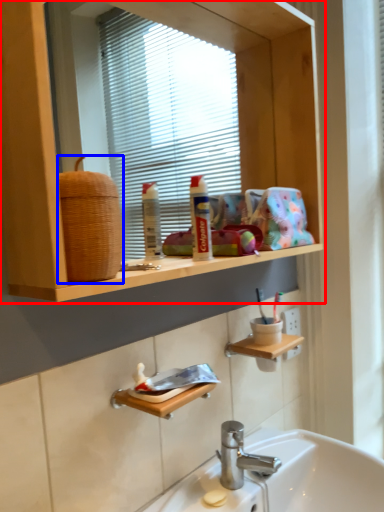
Question: Which object is closer to the camera taking this photo, bathroom cabinet (highlighted by a red box) or basket (highlighted by a blue box)?

Choices:
 (A) bathroom cabinet
 (B) basket

Answer: (A)